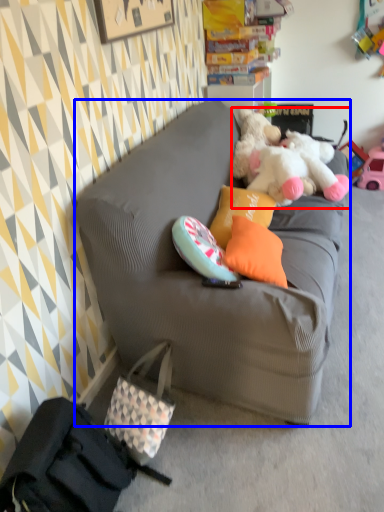
Question: Which object is closer to the camera taking this photo, teddy bear (highlighted by a red box) or studio couch (highlighted by a blue box)?

Choices:
 (A) teddy bear
 (B) studio couch

Answer: (B)